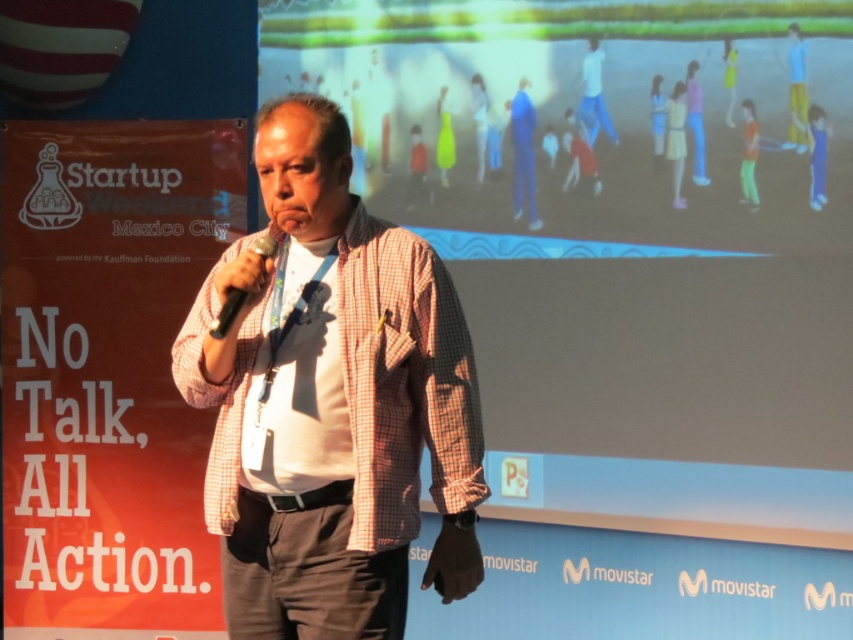
You are a photographer positioned at the back of the room. You want to take a photo of the man so that both the checkered fabric shirt at center and the black plastic microphone at center are clearly visible. Given that your camera has a minimum focus distance of 12 inches, will you be able to capture both objects in focus?

The checkered fabric shirt at center is 13.54 inches away from the black plastic microphone at center. Since the minimum focus distance of your camera is 12 inches, the 13.54 inches distance between them is greater than the minimum requirement, so both objects can be in focus in the photo.

You are an attendee at the event and you notice two points on the stage where you can place a small plant. The points are labeled as point (258, 156) and point (260, 252). Based on their positions, which point is closer to the front of the stage?

Point (258, 156) is closer to the front of the stage because it is further to the viewer compared to point (260, 252).

You are an attendee at a conference and you see the checkered fabric shirt at center and the black plastic microphone at center. Which object is positioned lower in the image?

The checkered fabric shirt at center is located below the black plastic microphone at center, so the checkered fabric shirt at center is positioned lower.